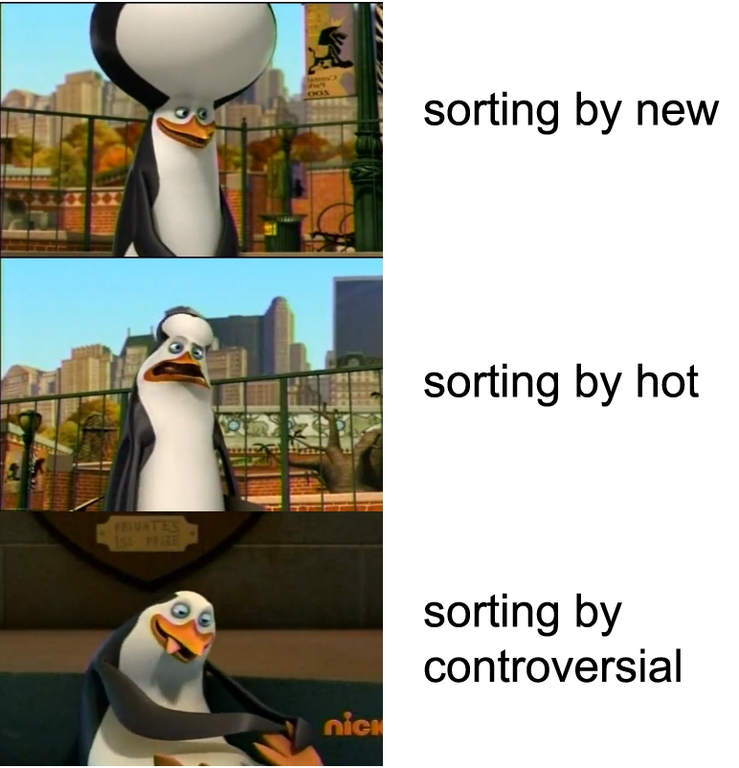
This screenshot has height=768, width=739. What are the coordinates of `wooden plaque` in the screenshot? It's located at (146, 568).